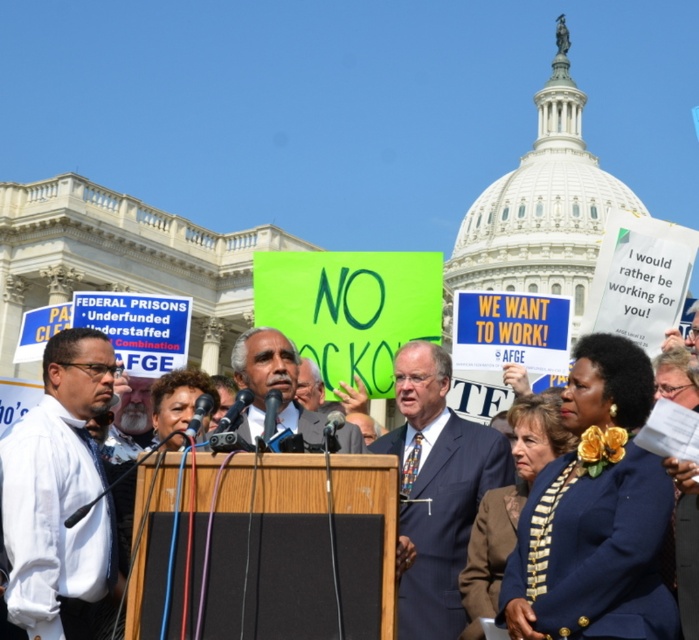
You are attending a press conference at the Capitol and notice two individuals in suits at the center. Which one is wearing a dark blue suit at center located to the left of the blue fabric suit at center?

The dark blue suit at center is positioned on the left side of the blue fabric suit at center, so the person in the dark blue suit at center is to the left of the blue fabric suit at center.

You are a photographer at the demonstration and need to capture both the dark blue suit at center and the matte black suit at center in a single frame. Based on their sizes, which suit will appear smaller in the photo?

The dark blue suit at center will appear smaller in the photo because its width is less than that of the matte black suit at center.